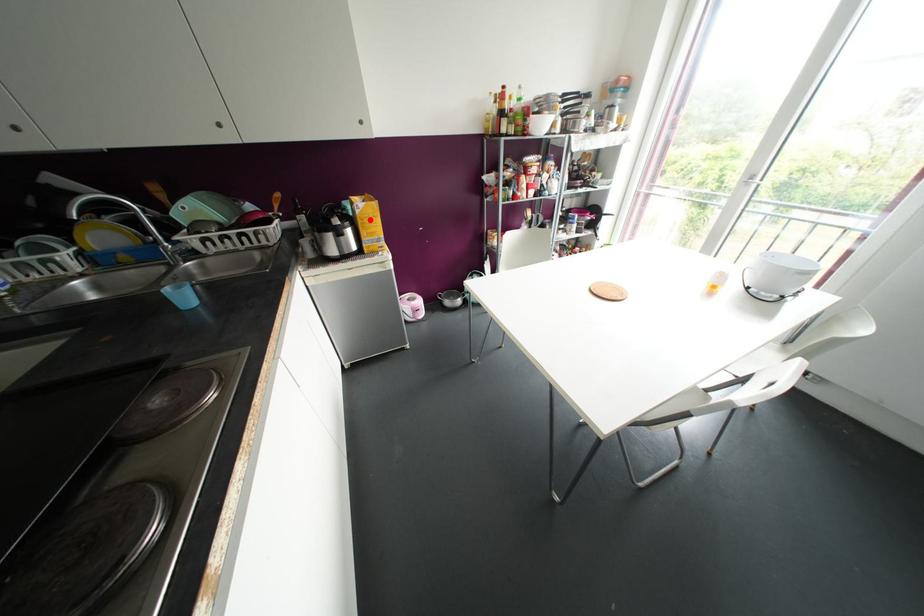
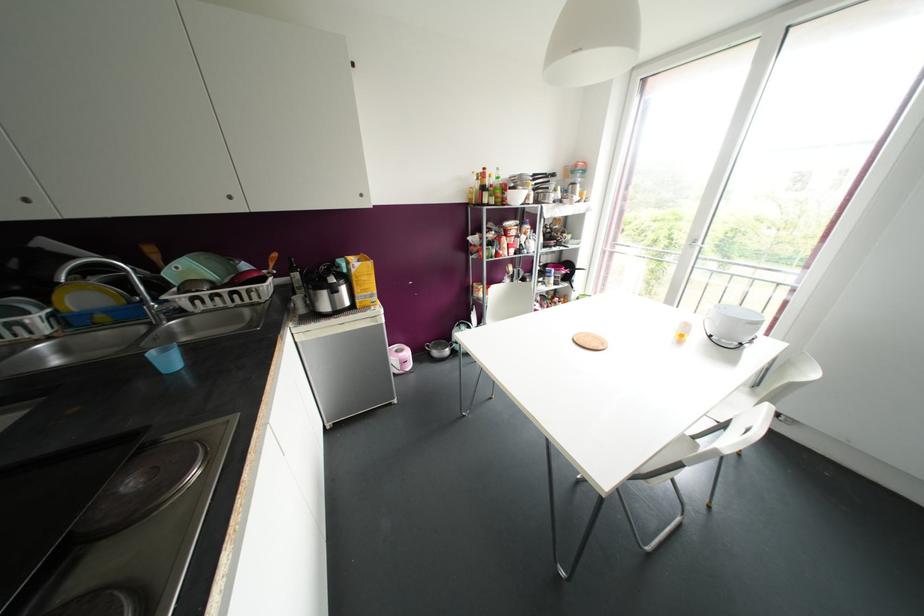
The point at the highlighted location is marked in the first image. Where is the corresponding point in the second image?

(363, 277)